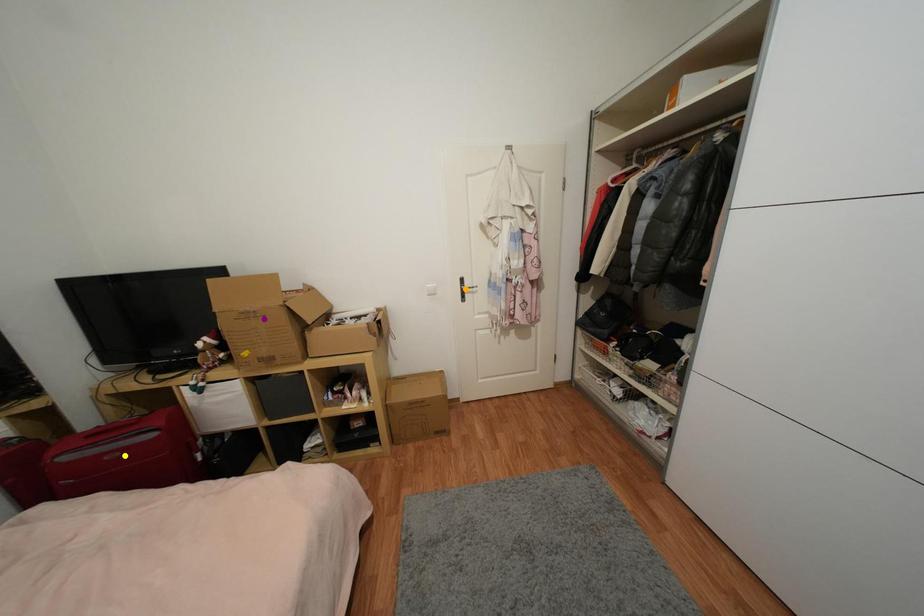
Order these from nearest to farthest:
orange point, purple point, yellow point

yellow point → purple point → orange point